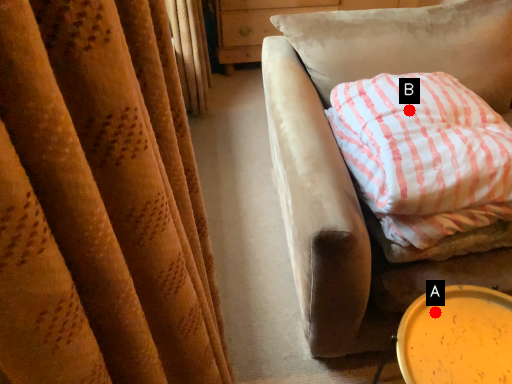
Question: Two points are circled on the image, labeled by A and B beside each circle. Which of the following is the closest to the observer?

Choices:
 (A) A is closer
 (B) B is closer

Answer: (A)